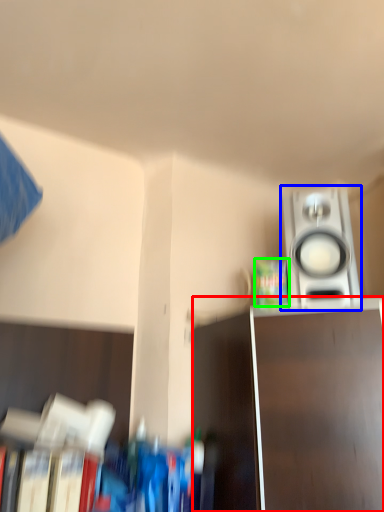
Question: Which is farther away from furniture (highlighted by a red box)? home appliance (highlighted by a blue box) or paperback book (highlighted by a green box)?

Choices:
 (A) home appliance
 (B) paperback book

Answer: (B)